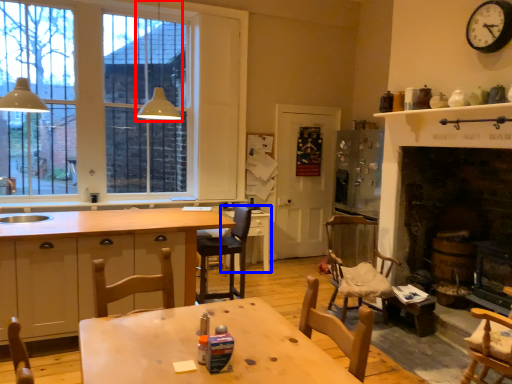
Question: Which object appears closest to the camera in this image, light fixture (highlighted by a red box) or table (highlighted by a blue box)?

Choices:
 (A) light fixture
 (B) table

Answer: (A)